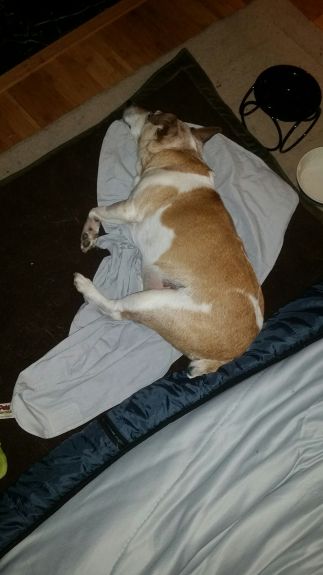
Locate an element on the screen. Image resolution: width=323 pixels, height=575 pixels. dog bed is located at coordinates pos(59,174).